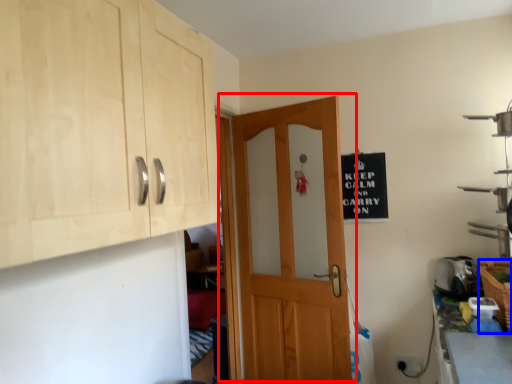
Question: Which object is further to the camera taking this photo, door (highlighted by a red box) or basket (highlighted by a blue box)?

Choices:
 (A) door
 (B) basket

Answer: (A)